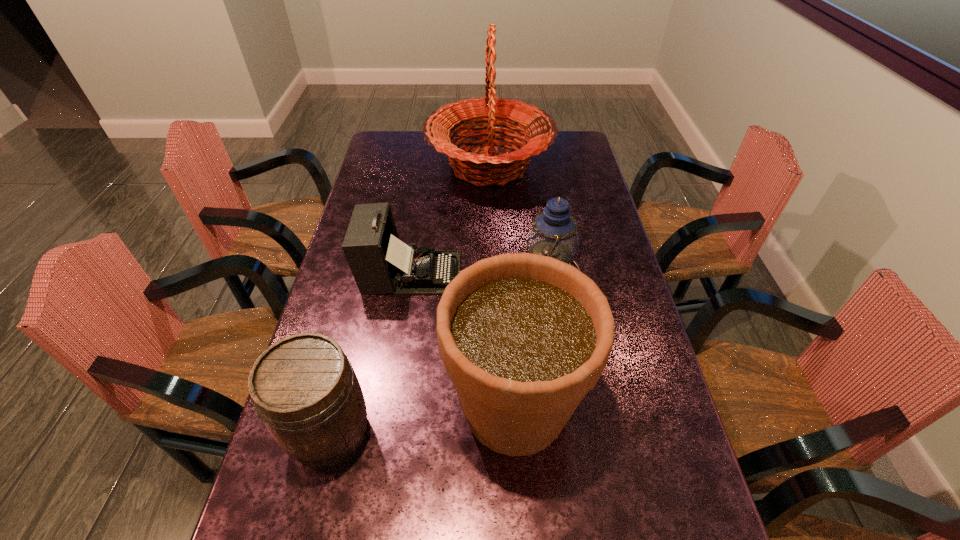
Locate an element on the screen. This screenshot has width=960, height=540. vacant space located on the front-facing side of the lantern is located at coordinates (406, 273).

At what (x,y) coordinates should I click in order to perform the action: click on free space located on the side of the cider near the bung hole. Please return your answer as a coordinate pair (x, y). Looking at the image, I should click on (502, 433).

The height and width of the screenshot is (540, 960). What are the coordinates of `free space located inside the open case of the typewriter` in the screenshot? It's located at (491, 273).

You are a GUI agent. You are given a task and a screenshot of the screen. Output one action in this format:
    pyautogui.click(x=<x>, y=<y>)
    Task: Click on the object present at the far edge
    This screenshot has height=540, width=960.
    Given the screenshot: What is the action you would take?
    point(478,167)

Where is `cider that is positioned at the left edge`? Image resolution: width=960 pixels, height=540 pixels. cider that is positioned at the left edge is located at coordinates (305, 390).

Identify the location of typewriter that is positioned at the left edge. The image size is (960, 540). (380, 262).

Identify the location of basket at the right edge. The height and width of the screenshot is (540, 960). (478, 167).

Identify the location of lantern that is at the right edge. (553, 233).

Identify the location of object present at the far right corner. The image size is (960, 540). (478, 167).

In the image, there is a desktop. Identify the location of vacant area at the left edge. Image resolution: width=960 pixels, height=540 pixels. (400, 208).